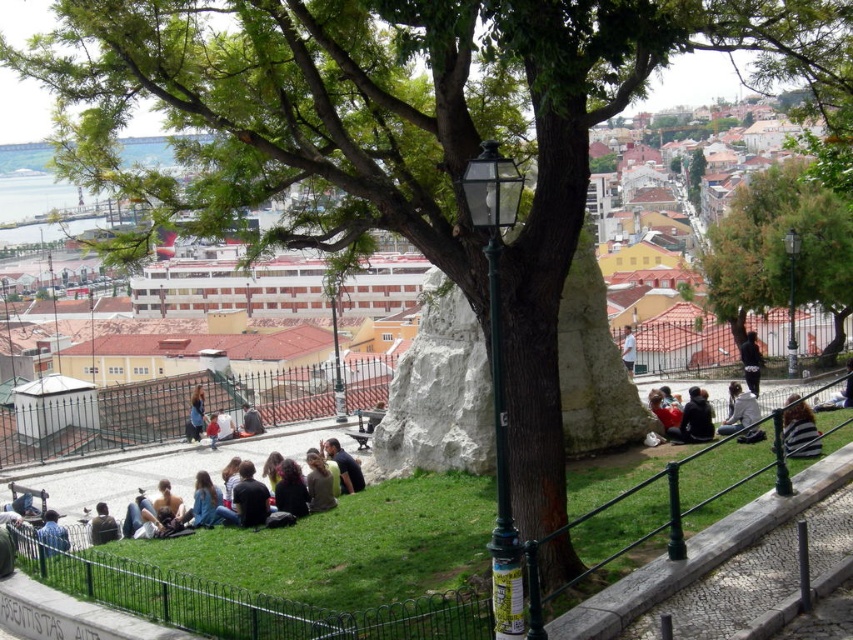
Question: Can you confirm if green leafy tree at upper right is positioned below dark green fabric jacket at center?

Choices:
 (A) yes
 (B) no

Answer: (B)

Question: Does dark blue sweater at center appear under dark gray sweater at center?

Choices:
 (A) no
 (B) yes

Answer: (A)

Question: Which point is closer to the camera?

Choices:
 (A) (54, 525)
 (B) (265, 513)
 (C) (242, 406)

Answer: (B)

Question: Is dark blue sweater at center positioned behind dark brown leather jacket at lower left?

Choices:
 (A) yes
 (B) no

Answer: (A)

Question: Estimate the real-world distances between objects in this image. Which object is farther from the dark brown leather jacket at lower left?

Choices:
 (A) striped fabric at lower right
 (B) green leafy tree at upper right

Answer: (B)

Question: Which point appears closest to the camera in this image?

Choices:
 (A) [651, 410]
 (B) [250, 525]
 (C) [730, 428]
 (D) [314, 497]

Answer: (B)